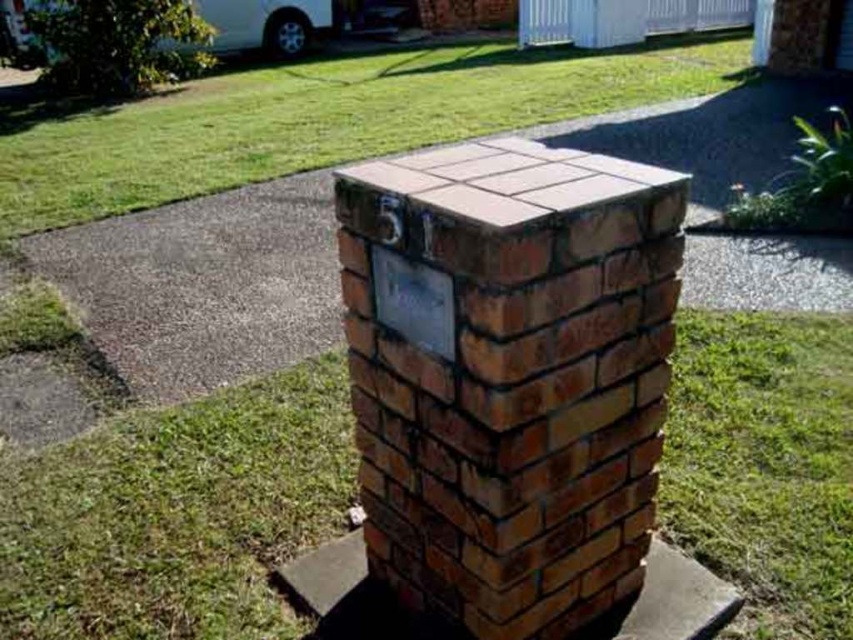
Question: Which point appears farthest from the camera in this image?

Choices:
 (A) (764, 579)
 (B) (264, 435)
 (C) (613, 284)
 (D) (612, 76)

Answer: (D)

Question: Estimate the real-world distances between objects in this image. Which object is farther from the green grass at upper center?

Choices:
 (A) green grass at lower right
 (B) brown brick chimney at center

Answer: (B)

Question: Does green grass at upper center appear on the left side of green grass at lower right?

Choices:
 (A) no
 (B) yes

Answer: (B)

Question: Is brown brick chimney at center positioned at the back of green grass at center?

Choices:
 (A) yes
 (B) no

Answer: (B)

Question: Among these objects, which one is nearest to the camera?

Choices:
 (A) green grass at lower right
 (B) green grass at upper center

Answer: (A)

Question: Can you confirm if brown brick chimney at center is bigger than green grass at center?

Choices:
 (A) no
 (B) yes

Answer: (A)